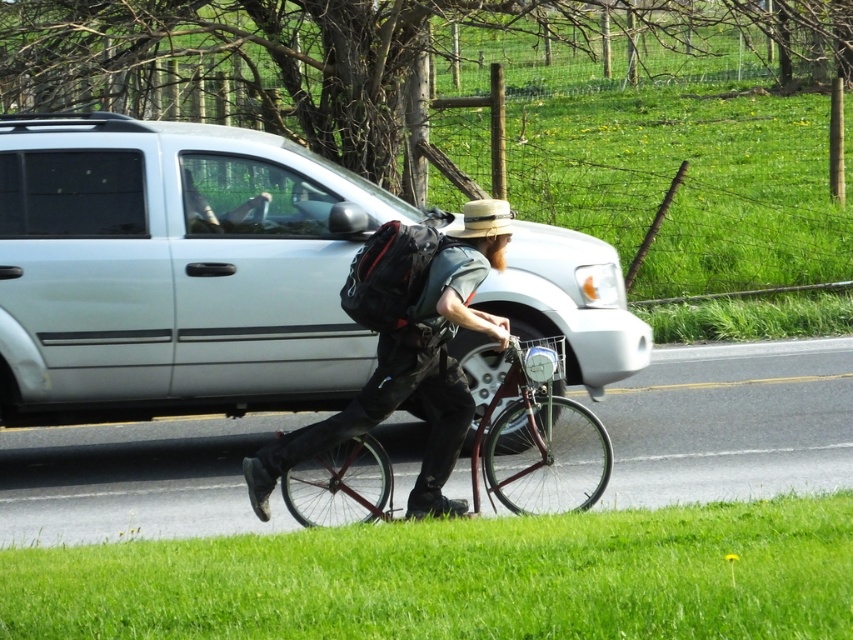
Question: Considering the real-world distances, which object is farthest from the natural straw hat at center?

Choices:
 (A) silver metallic truck at center-left
 (B) metallic red bicycle at center
 (C) matte black backpack at center

Answer: (A)

Question: Which object is positioned closest to the matte black backpack at center?

Choices:
 (A) metallic red bicycle at center
 (B) natural straw hat at center
 (C) silver metallic truck at center-left

Answer: (B)

Question: Does matte black backpack at center appear on the left side of metallic red bicycle at center?

Choices:
 (A) yes
 (B) no

Answer: (A)

Question: Observing the image, what is the correct spatial positioning of metallic red bicycle at center in reference to natural straw hat at center?

Choices:
 (A) right
 (B) left

Answer: (A)

Question: Estimate the real-world distances between objects in this image. Which object is closer to the metallic red bicycle at center?

Choices:
 (A) matte black backpack at center
 (B) silver metallic truck at center-left

Answer: (A)

Question: Is matte black backpack at center positioned behind metallic red bicycle at center?

Choices:
 (A) no
 (B) yes

Answer: (A)